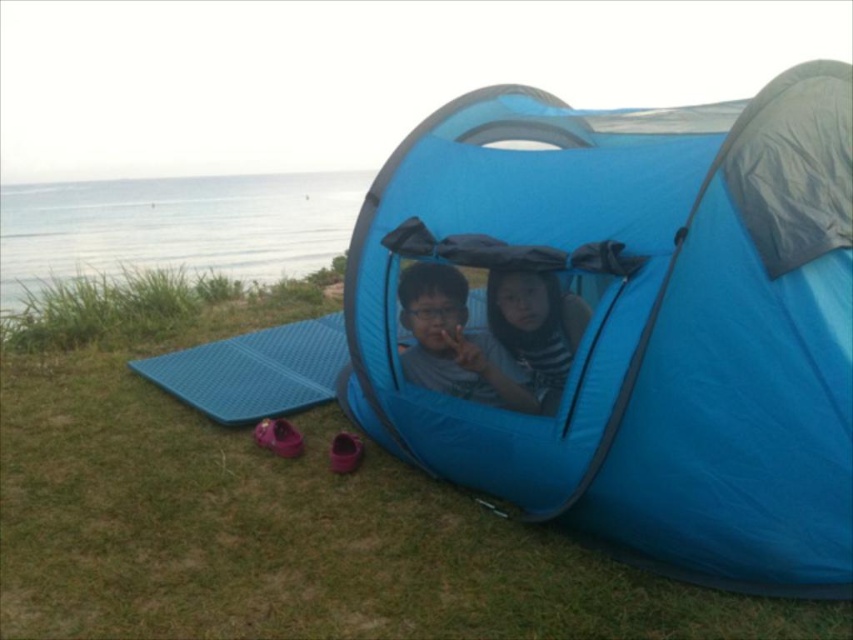
Does blue fabric tent at center come in front of matte blue tent at center?

That is True.

Is blue fabric tent at center below matte blue tent at center?

No.

Between point (804, 125) and point (434, 348), which one is positioned in front?

Point (804, 125) is more forward.

At what (x,y) coordinates should I click in order to perform the action: click on blue fabric tent at center. Please return your answer as a coordinate pair (x, y). Looking at the image, I should click on (642, 321).

Between point (393, 445) and point (531, 374), which one is positioned in front?

Point (531, 374) is more forward.

Measure the distance from blue fabric tent at center to striped fabric shirt at center.

15.50 inches

Who is more distant from viewer, (709, 180) or (538, 388)?

Positioned behind is point (538, 388).

Where is `blue fabric tent at center`? The width and height of the screenshot is (853, 640). blue fabric tent at center is located at coordinates (642, 321).

Does point (195, 360) lie in front of point (555, 384)?

No, (195, 360) is behind (555, 384).

Who is more distant from viewer, (332, 323) or (521, 298)?

The point (332, 323) is behind.

What are the coordinates of `blue foam mat at lower center` in the screenshot? It's located at (254, 371).

You are a GUI agent. You are given a task and a screenshot of the screen. Output one action in this format:
    pyautogui.click(x=<x>, y=<y>)
    Task: Click on the blue foam mat at lower center
    
    Given the screenshot: What is the action you would take?
    pyautogui.click(x=254, y=371)